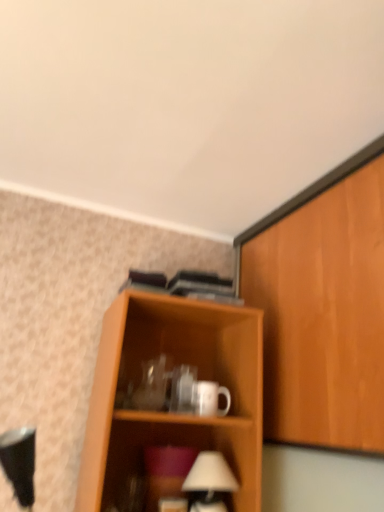
Question: From a real-world perspective, is wooden cabinet at right physically located above or below white glossy mug at center?

Choices:
 (A) below
 (B) above

Answer: (B)

Question: Looking at their shapes, would you say wooden cabinet at right is wider or thinner than white glossy mug at center?

Choices:
 (A) thin
 (B) wide

Answer: (B)

Question: Which object is the closest to the white matte table lamp at lower center?

Choices:
 (A) wooden cabinet at right
 (B) white glossy mug at center

Answer: (B)

Question: Which object is positioned farthest from the white matte table lamp at lower center?

Choices:
 (A) white glossy mug at center
 (B) wooden cabinet at right

Answer: (B)